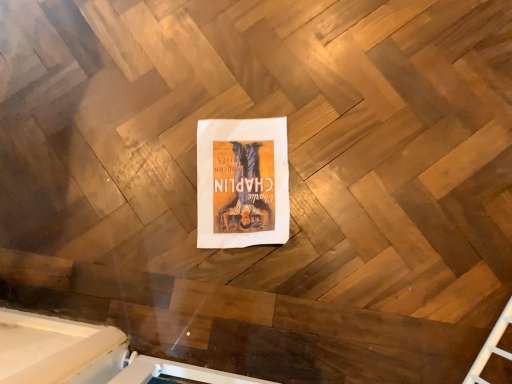
Locate an element on the screen. This screenshot has width=512, height=384. vacant space situated on the left part of white paper poster at center is located at coordinates (141, 196).